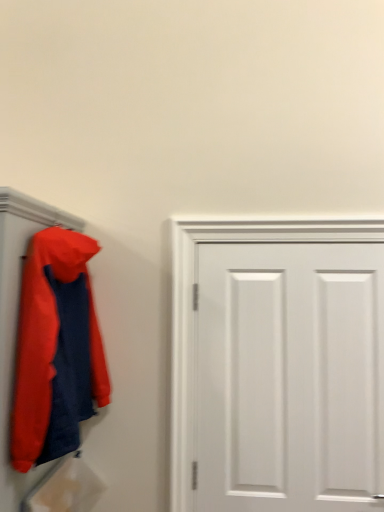
Question: Considering the positions of matte orange jacket at left and white matte door at center in the image, is matte orange jacket at left wider or thinner than white matte door at center?

Choices:
 (A) wide
 (B) thin

Answer: (A)

Question: Considering the positions of point (39, 285) and point (327, 494), is point (39, 285) closer or farther from the camera than point (327, 494)?

Choices:
 (A) farther
 (B) closer

Answer: (B)

Question: Would you say matte orange jacket at left is to the left or to the right of white matte door at center in the picture?

Choices:
 (A) right
 (B) left

Answer: (B)

Question: From a real-world perspective, is white matte door at center above or below matte orange jacket at left?

Choices:
 (A) below
 (B) above

Answer: (A)

Question: In terms of height, does white matte door at center look taller or shorter compared to matte orange jacket at left?

Choices:
 (A) tall
 (B) short

Answer: (A)

Question: Considering the positions of white matte door at center and matte orange jacket at left in the image, is white matte door at center bigger or smaller than matte orange jacket at left?

Choices:
 (A) small
 (B) big

Answer: (A)

Question: Considering their positions, is white matte door at center located in front of or behind matte orange jacket at left?

Choices:
 (A) behind
 (B) front

Answer: (A)